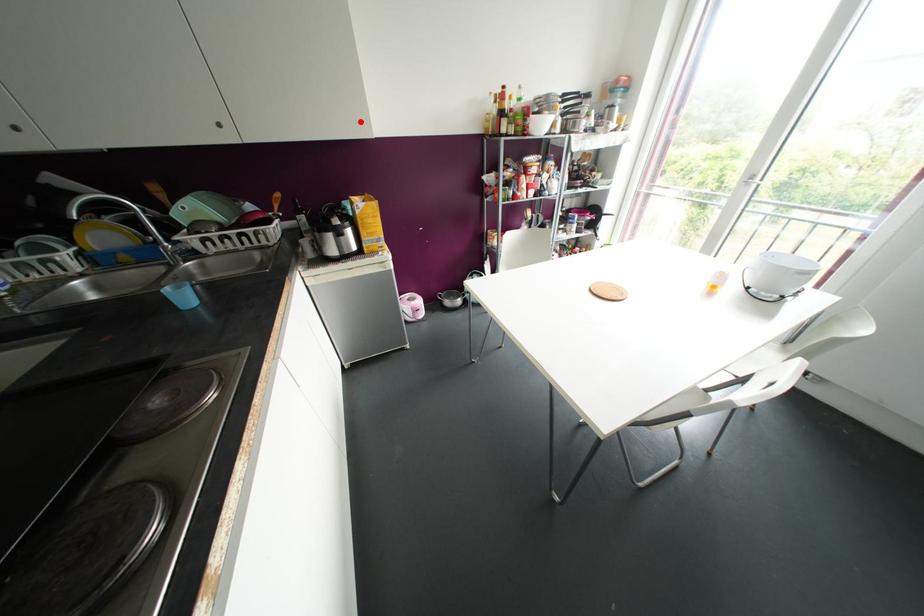
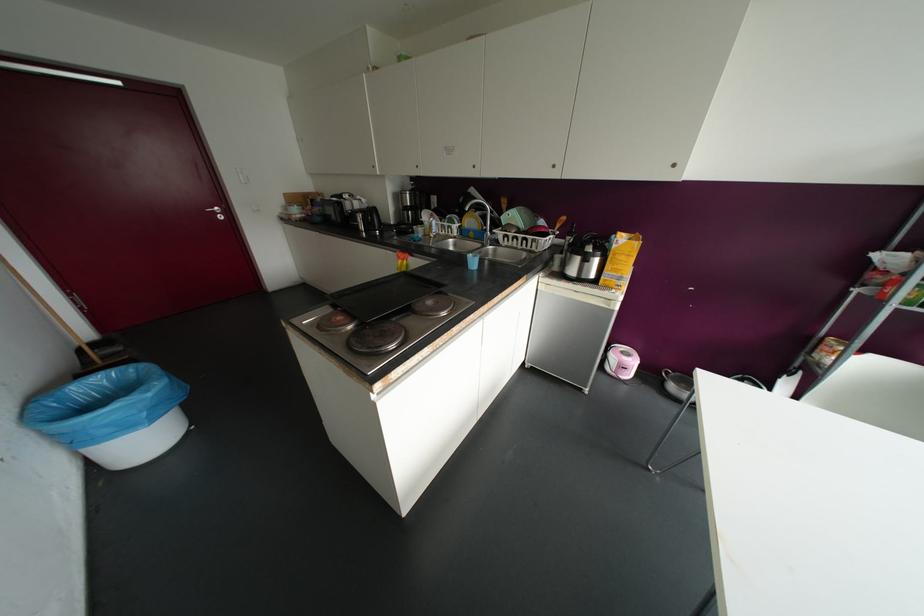
Find the pixel in the second image that matches the highlighted location in the first image.

(673, 164)